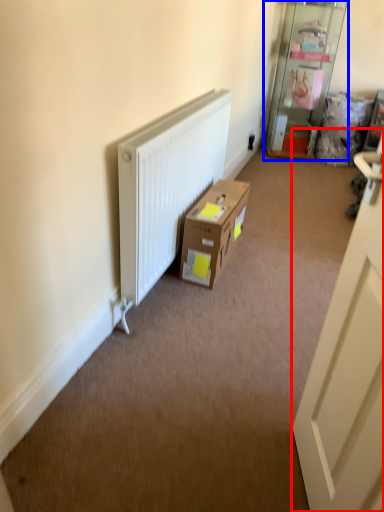
Question: Which point is closer to the camera, door (highlighted by a red box) or shelf (highlighted by a blue box)?

Choices:
 (A) door
 (B) shelf

Answer: (A)